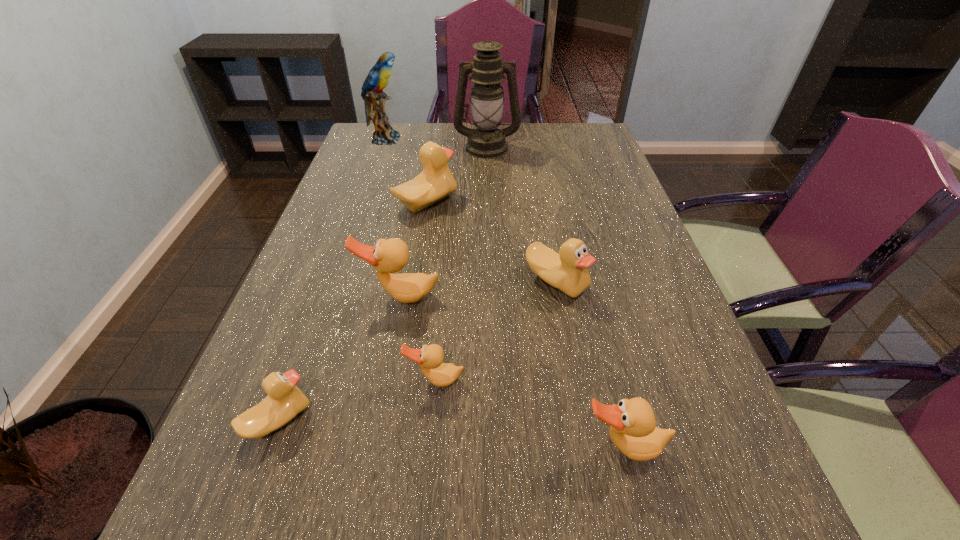
The height and width of the screenshot is (540, 960). I want to click on blank space located on the beak of the third nearest duck, so click(x=430, y=437).

This screenshot has width=960, height=540. In order to click on oil lamp present at the far edge in this screenshot , I will do click(x=487, y=70).

You are a GUI agent. You are given a task and a screenshot of the screen. Output one action in this format:
    pyautogui.click(x=<x>, y=<y>)
    Task: Click on the parrot that is at the far edge
    
    Given the screenshot: What is the action you would take?
    pyautogui.click(x=378, y=77)

Locate an element on the screen. The image size is (960, 540). parrot present at the left edge is located at coordinates (378, 77).

You are a GUI agent. You are given a task and a screenshot of the screen. Output one action in this format:
    pyautogui.click(x=<x>, y=<y>)
    Task: Click on the duck located at the left edge
    The width and height of the screenshot is (960, 540).
    Given the screenshot: What is the action you would take?
    pyautogui.click(x=285, y=400)

Find the location of `object that is at the right edge`. object that is at the right edge is located at coordinates (633, 430).

What are the coordinates of `object that is at the far left corner` in the screenshot? It's located at (378, 77).

This screenshot has height=540, width=960. In order to click on free space at the far edge in this screenshot , I will do `click(528, 147)`.

This screenshot has width=960, height=540. In the image, there is a desktop. Identify the location of free region at the left edge. (296, 308).

Where is `free region at the right edge of the desktop`? This screenshot has height=540, width=960. free region at the right edge of the desktop is located at coordinates (591, 214).